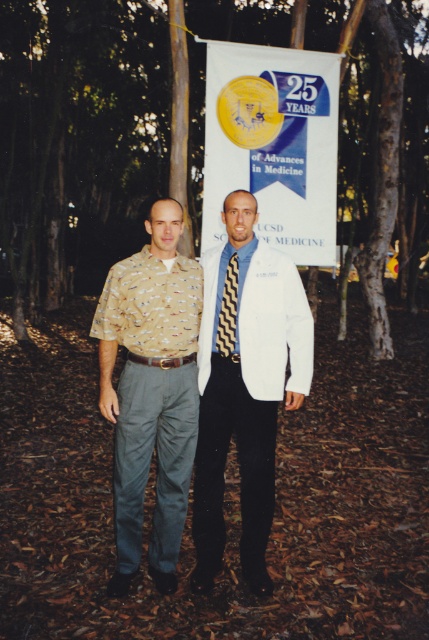
Question: Is white cotton dress shirt at center positioned behind black zigzag tie at center?

Choices:
 (A) yes
 (B) no

Answer: (B)

Question: Is brown bark tree at center to the left of black zigzag tie at center from the viewer's perspective?

Choices:
 (A) yes
 (B) no

Answer: (B)

Question: Is brown bark tree at center below camouflage shirt at left?

Choices:
 (A) no
 (B) yes

Answer: (A)

Question: Which of the following is the farthest from the observer?

Choices:
 (A) white cotton dress shirt at center
 (B) camouflage shirt at left
 (C) black zigzag tie at center

Answer: (C)

Question: Which is nearer to the brown bark tree at center?

Choices:
 (A) white cotton dress shirt at center
 (B) white smooth coat at center
 (C) black zigzag tie at center

Answer: (A)

Question: Considering the real-world distances, which object is farthest from the brown bark tree at center?

Choices:
 (A) white smooth coat at center
 (B) black zigzag tie at center

Answer: (B)